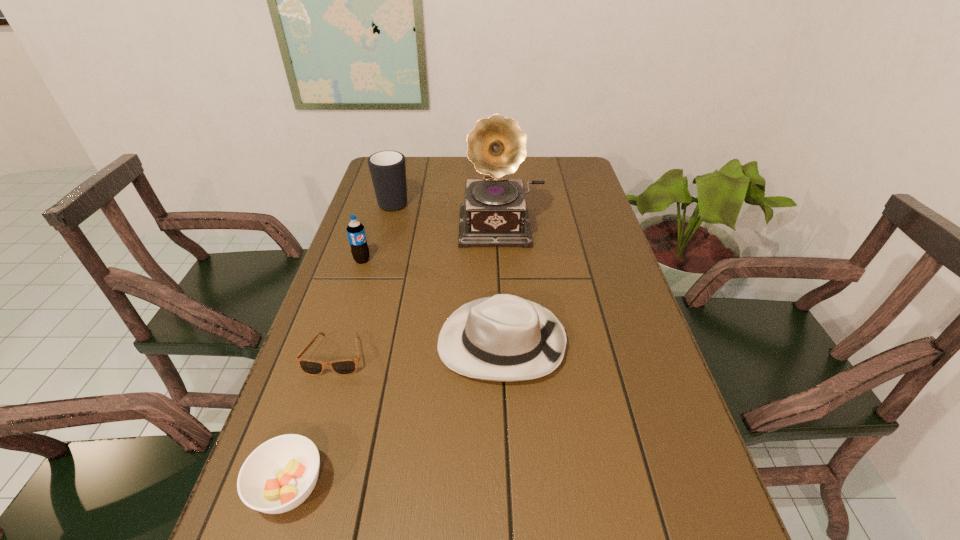
Where is `the tallest object`? the tallest object is located at coordinates (495, 213).

At what (x,y) coordinates should I click in order to perform the action: click on mug. Please return your answer as a coordinate pair (x, y). Image resolution: width=960 pixels, height=540 pixels. Looking at the image, I should click on (387, 168).

This screenshot has height=540, width=960. I want to click on soda bottle, so click(x=355, y=230).

The height and width of the screenshot is (540, 960). Find the location of `the fourth tallest object`. the fourth tallest object is located at coordinates coord(505,338).

Where is `the nearest object`? This screenshot has width=960, height=540. the nearest object is located at coordinates (280, 474).

Find the location of a particular element. Image resolution: width=960 pixels, height=540 pixels. the fifth tallest object is located at coordinates (280, 474).

Locate an element on the screen. The image size is (960, 540). the shortest object is located at coordinates (348, 366).

The height and width of the screenshot is (540, 960). I want to click on vacant space located on the horn of the record player, so click(506, 274).

I want to click on free space located on the side of the mug with the handle, so click(x=404, y=164).

Find the location of a particular element. The height and width of the screenshot is (540, 960). free point located 0.120m on the side of the mug with the handle is located at coordinates 402,172.